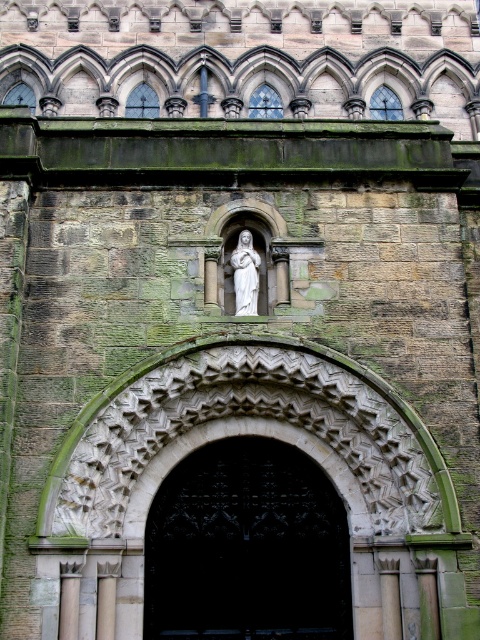
Question: Does black wrought iron gate at center appear over white marble statue at center?

Choices:
 (A) yes
 (B) no

Answer: (B)

Question: Is black wrought iron gate at center below white marble statue at center?

Choices:
 (A) no
 (B) yes

Answer: (B)

Question: Does black wrought iron gate at center appear on the right side of white marble statue at center?

Choices:
 (A) no
 (B) yes

Answer: (A)

Question: Which point is closer to the camera?

Choices:
 (A) (204, 564)
 (B) (237, 257)

Answer: (A)